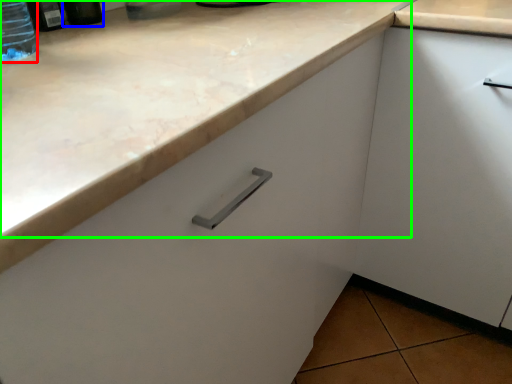
Question: Estimate the real-world distances between objects in this image. Which object is closer to bottle (highlighted by a red box), bottle (highlighted by a blue box) or counter top (highlighted by a green box)?

Choices:
 (A) bottle
 (B) counter top

Answer: (A)